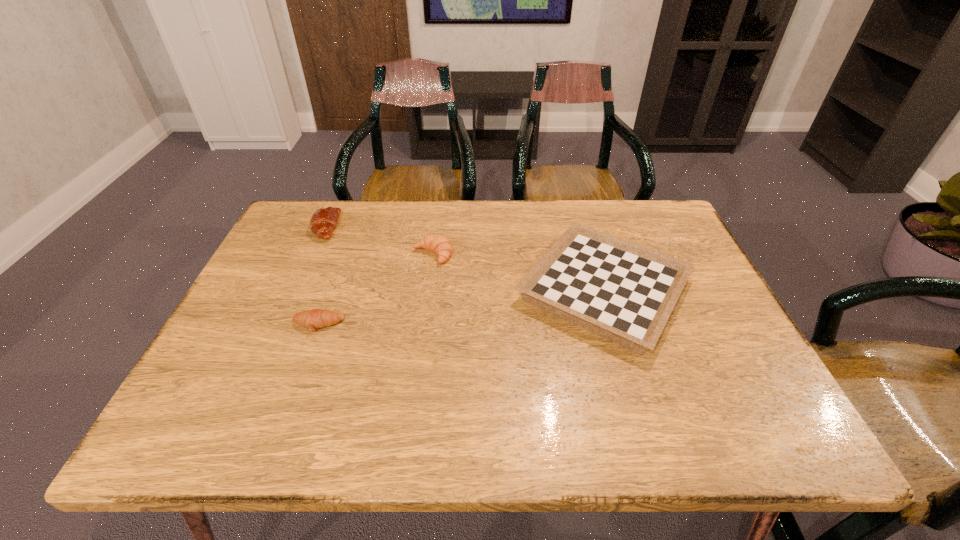
Locate an element on the screen. free spot between the second object from right to left and the shortest crescent roll is located at coordinates (375, 289).

This screenshot has width=960, height=540. I want to click on free point between the nearest crescent roll and the second object from right to left, so click(x=375, y=289).

Locate an element on the screen. This screenshot has width=960, height=540. object that is the closest to the nearest crescent roll is located at coordinates (440, 245).

The width and height of the screenshot is (960, 540). I want to click on object that stands as the third closest to the rightmost crescent roll, so click(324, 220).

Identify the location of the closest crescent roll to the rightmost object. Image resolution: width=960 pixels, height=540 pixels. (440, 245).

Identify which crescent roll is the second closest to the shortest crescent roll. Please provide its 2D coordinates. Your answer should be formatted as a tuple, i.e. [(x, y)], where the tuple contains the x and y coordinates of a point satisfying the conditions above.

[(324, 220)]

Locate an element on the screen. This screenshot has height=540, width=960. vacant region that satisfies the following two spatial constraints: 1. on the front side of the rightmost crescent roll; 2. on the right side of the rightmost object is located at coordinates pyautogui.click(x=428, y=289).